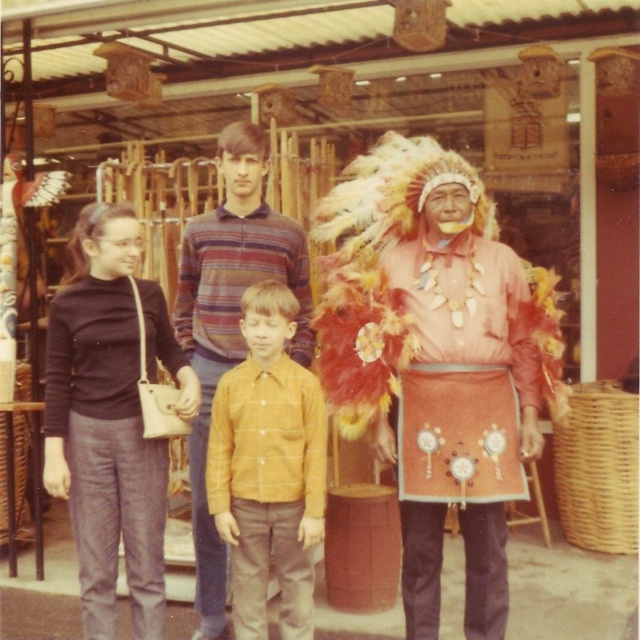
Does matte orange shirt at center have a smaller size compared to yellow checkered shirt at center?

No, matte orange shirt at center is not smaller than yellow checkered shirt at center.

Between matte orange shirt at center and yellow checkered shirt at center, which one appears on the right side from the viewer's perspective?

Positioned to the right is matte orange shirt at center.

Does point (337, 234) come farther from viewer compared to point (276, 436)?

Yes, it is.

Find the location of a particular element. matte orange shirt at center is located at coordinates (436, 358).

Between matte orange shirt at center and dark brown fabric pants at left, which one has less height?

With less height is dark brown fabric pants at left.

Between point (440, 300) and point (134, 364), which one is positioned behind?

Positioned behind is point (134, 364).

The image size is (640, 640). Find the location of `matte orange shirt at center`. matte orange shirt at center is located at coordinates (436, 358).

Locate an element on the screen. The image size is (640, 640). matte orange shirt at center is located at coordinates (436, 358).

Does point (124, 348) come in front of point (227, 516)?

That is False.

Does dark brown fabric pants at left have a lesser width compared to yellow checkered shirt at center?

No.

Which is behind, point (104, 454) or point (252, 552)?

The point (252, 552) is more distant.

You are a GUI agent. You are given a task and a screenshot of the screen. Output one action in this format:
    pyautogui.click(x=<x>, y=<y>)
    Task: Click on the dark brown fabric pants at left
    The image size is (640, 640).
    Given the screenshot: What is the action you would take?
    pyautogui.click(x=106, y=451)